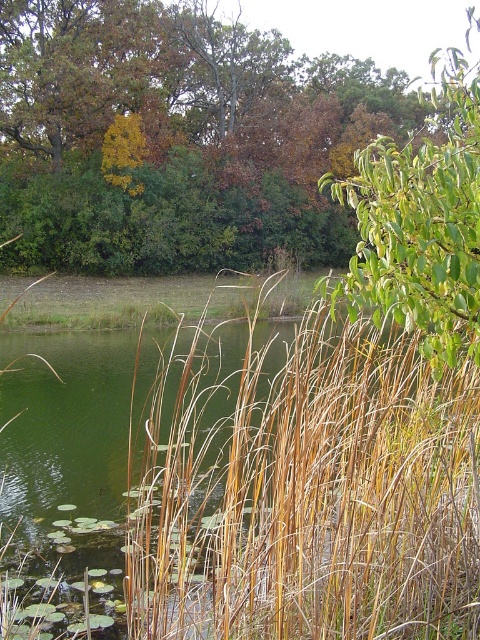
Question: In this image, where is brown leafy tree at upper center located relative to green leafy tree at upper right?

Choices:
 (A) right
 (B) left

Answer: (B)

Question: Among these objects, which one is nearest to the camera?

Choices:
 (A) brown leafy tree at upper center
 (B) green leafy tree at upper right

Answer: (B)

Question: Does brown dry grass at center appear over brown leafy tree at upper center?

Choices:
 (A) yes
 (B) no

Answer: (B)

Question: Among these objects, which one is farthest from the camera?

Choices:
 (A) green leafy tree at upper right
 (B) brown leafy tree at upper center

Answer: (B)

Question: Which point is closer to the camera?

Choices:
 (A) green leafy tree at upper right
 (B) brown dry grass at center
 (C) brown leafy tree at upper center

Answer: (B)

Question: Is brown leafy tree at upper center thinner than green leafy tree at upper right?

Choices:
 (A) no
 (B) yes

Answer: (B)